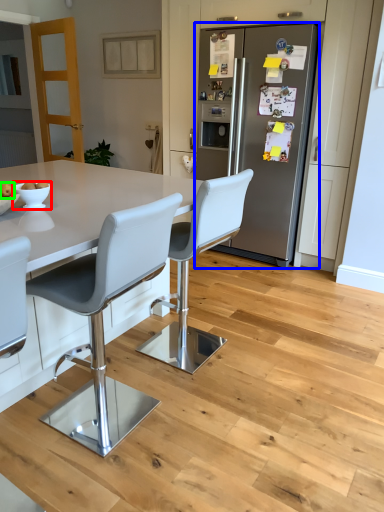
Question: Which object is the farthest from bowl (highlighted by a red box)? Choose among these: refrigerator (highlighted by a blue box) or fruit (highlighted by a green box).

Choices:
 (A) refrigerator
 (B) fruit

Answer: (A)